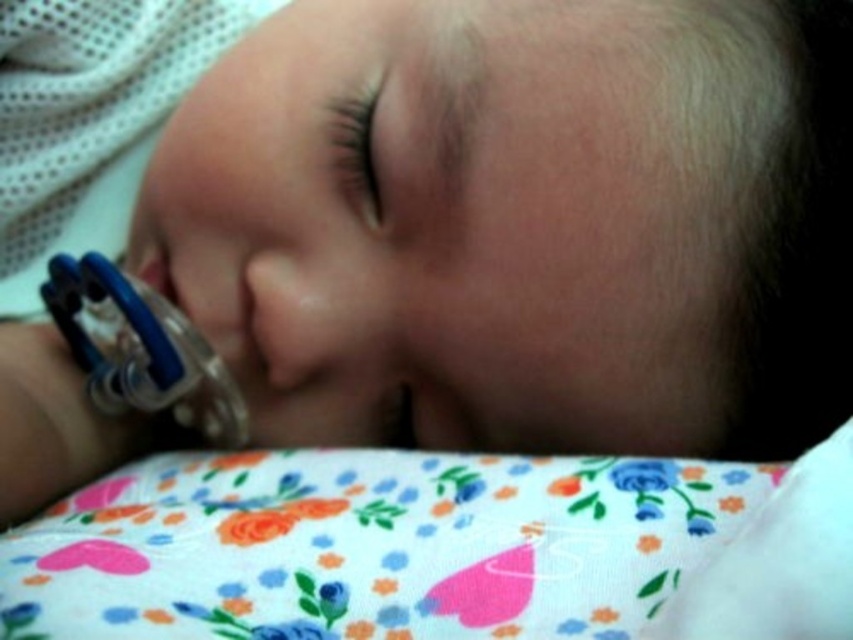
Question: Which point is closer to the camera taking this photo?

Choices:
 (A) (51, 563)
 (B) (50, 308)

Answer: (A)

Question: From the image, what is the correct spatial relationship of floral fabric pillow at lower center in relation to blue rubber teething ring at left?

Choices:
 (A) below
 (B) above

Answer: (A)

Question: Is floral fabric pillow at lower center smaller than blue rubber teething ring at left?

Choices:
 (A) no
 (B) yes

Answer: (A)

Question: Does floral fabric pillow at lower center appear on the left side of blue rubber teething ring at left?

Choices:
 (A) no
 (B) yes

Answer: (A)